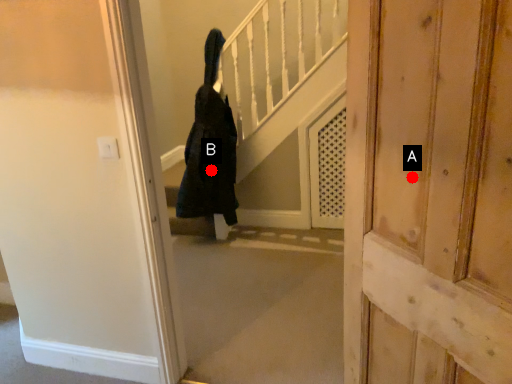
Question: Two points are circled on the image, labeled by A and B beside each circle. Which point is farther from the camera taking this photo?

Choices:
 (A) A is further
 (B) B is further

Answer: (B)